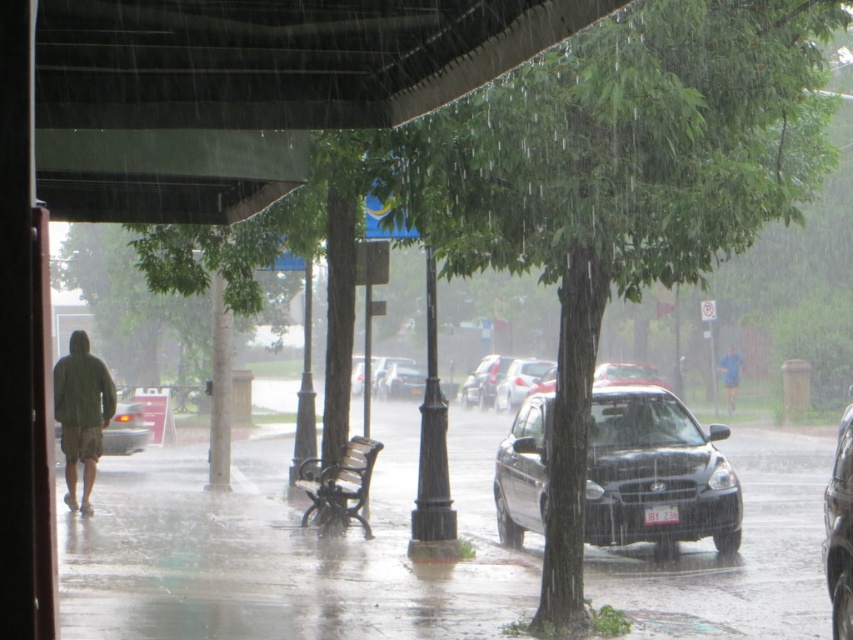
Who is higher up, black matte car at center or blue fabric person at center-right?

Positioned higher is blue fabric person at center-right.

Is point (670, 524) positioned behind point (726, 400)?

No, (670, 524) is in front of (726, 400).

This screenshot has height=640, width=853. What do you see at coordinates (656, 474) in the screenshot?
I see `black matte car at center` at bounding box center [656, 474].

The height and width of the screenshot is (640, 853). In order to click on black matte car at center in this screenshot , I will do `click(656, 474)`.

Is silver metallic sedan at center behind blue fabric person at center-right?

Yes, silver metallic sedan at center is behind blue fabric person at center-right.

Which is in front, point (517, 364) or point (726, 364)?

Point (726, 364)

Identify the location of silver metallic sedan at center. (519, 381).

Locate an element on the screen. The width and height of the screenshot is (853, 640). wooden bench at center is located at coordinates (339, 484).

Is wooden bench at center in front of blue fabric person at center-right?

Yes.

Which is in front, point (337, 476) or point (734, 378)?

Positioned in front is point (337, 476).

Where is `wooden bench at center`? wooden bench at center is located at coordinates (339, 484).